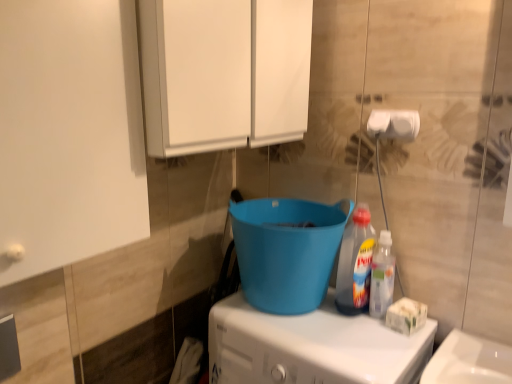
Where is `blank space to the left of translucent plastic bottle at center-right, the 2th bottle viewed from the right`? blank space to the left of translucent plastic bottle at center-right, the 2th bottle viewed from the right is located at coordinates (303, 319).